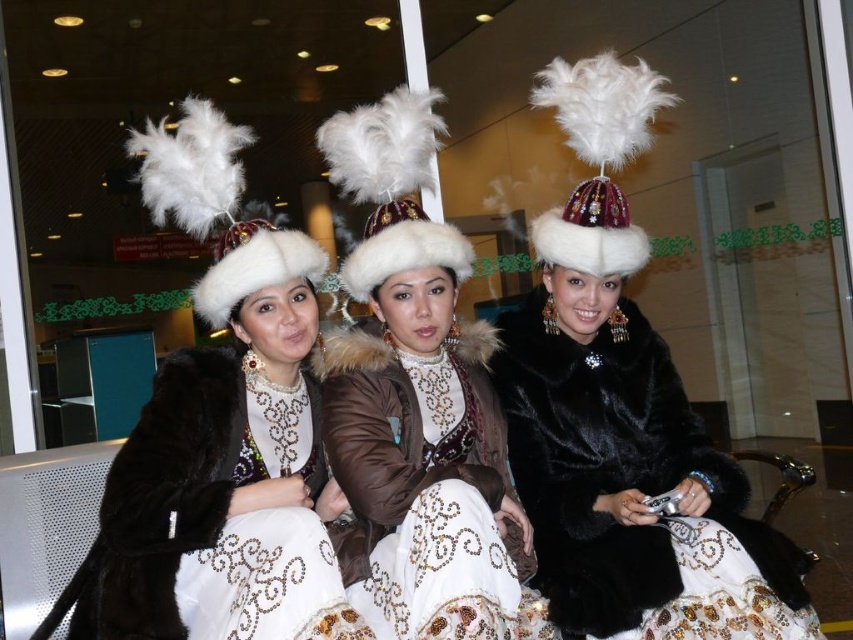
Based on the photo, who is positioned more to the left, brown leather jacket at center or black fur coat at center?

Positioned to the left is brown leather jacket at center.

Is point (341, 544) closer to camera compared to point (659, 371)?

Yes, it is.

Where is `brown leather jacket at center`? brown leather jacket at center is located at coordinates (425, 490).

Looking at this image, can you confirm if matte black fur coat at left is taller than brown leather jacket at center?

Indeed, matte black fur coat at left has a greater height compared to brown leather jacket at center.

Measure the distance between matte black fur coat at left and brown leather jacket at center.

9.76 inches

Consider the image. Who is more forward, (199, 541) or (454, 433)?

Point (199, 541)

Identify the location of matte black fur coat at left. This screenshot has width=853, height=640. (225, 474).

Is matte black fur coat at left below black fur coat at center?

Incorrect, matte black fur coat at left is not positioned below black fur coat at center.

Locate an element on the screen. matte black fur coat at left is located at coordinates pos(225,474).